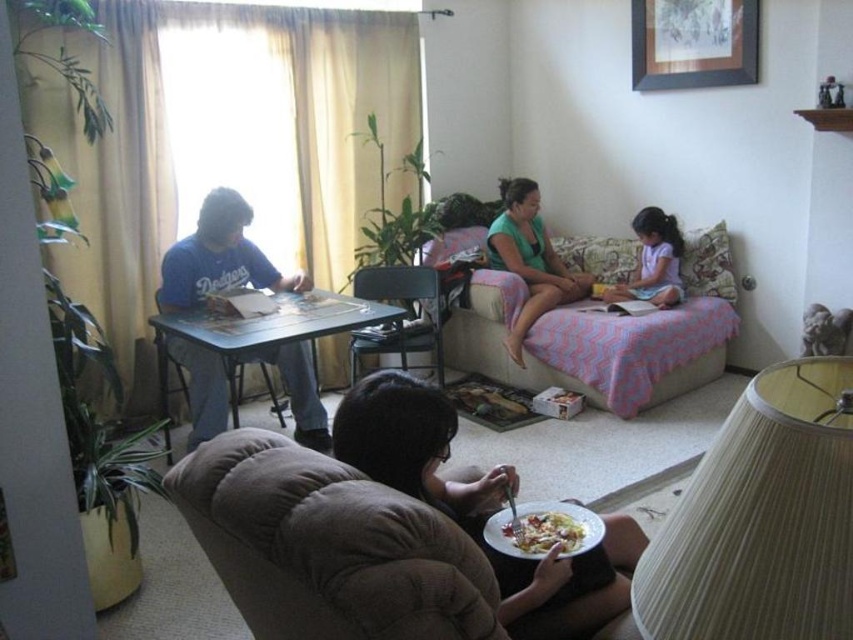
Question: Considering the real-world distances, which object is farthest from the blue plastic table at left?

Choices:
 (A) black plastic chair at center
 (B) white glossy plate at lower center

Answer: (B)

Question: Is the position of pink fabric couch at upper center less distant than that of green cotton shirt at center?

Choices:
 (A) yes
 (B) no

Answer: (A)

Question: Based on their relative distances, which object is farther from the matte blue shirt at left?

Choices:
 (A) white glossy plate at lower center
 (B) brown fabric couch at lower center
 (C) pink fabric couch at upper center

Answer: (A)

Question: Can you confirm if matte blue shirt at left is wider than black plastic chair at center?

Choices:
 (A) no
 (B) yes

Answer: (B)

Question: Can you confirm if blue plastic table at left is thinner than white glossy plate at lower center?

Choices:
 (A) yes
 (B) no

Answer: (B)

Question: Which of these objects is positioned farthest from the white glossy plate at lower center?

Choices:
 (A) green cotton shirt at center
 (B) brown fabric couch at lower center
 (C) pink fabric couch at upper center

Answer: (A)